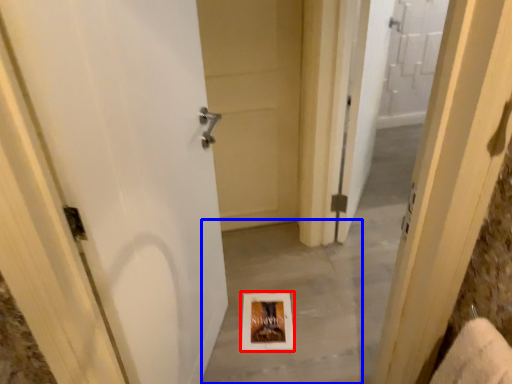
Question: Which point is closer to the camera, picture frame (highlighted by a red box) or concrete (highlighted by a blue box)?

Choices:
 (A) picture frame
 (B) concrete

Answer: (B)